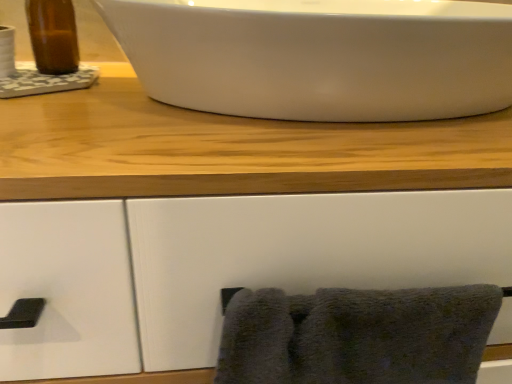
Describe the element at coordinates (356, 335) in the screenshot. I see `dark gray fluffy towel at lower right` at that location.

In order to click on white glossy sink at upper center, acting as the 2th sink starting from the left in this screenshot , I will do `click(320, 57)`.

What do you see at coordinates (46, 57) in the screenshot? I see `brown glass bottle at upper left, the 1th sink when ordered from left to right` at bounding box center [46, 57].

At what (x,y) coordinates should I click in order to perform the action: click on brown glass bottle at upper left, the 1th sink when ordered from left to right. Please return your answer as a coordinate pair (x, y). The width and height of the screenshot is (512, 384). Looking at the image, I should click on (46, 57).

Locate an element on the screen. The image size is (512, 384). dark gray fluffy towel at lower right is located at coordinates (356, 335).

How many degrees apart are the facing directions of white glossy sink at upper center, the 1th sink when ordered from right to left, and dark gray fluffy towel at lower right?

The angular difference between white glossy sink at upper center, the 1th sink when ordered from right to left, and dark gray fluffy towel at lower right is 1.04 degrees.

Can you confirm if white glossy sink at upper center, the 1th sink when ordered from right to left, is positioned to the left of dark gray fluffy towel at lower right?

No.

Looking at this image, is white glossy sink at upper center, acting as the 2th sink starting from the left, turned away from dark gray fluffy towel at lower right?

That's not correct — white glossy sink at upper center, acting as the 2th sink starting from the left, is not looking away from dark gray fluffy towel at lower right.

Are white glossy sink at upper center, acting as the 2th sink starting from the left, and dark gray fluffy towel at lower right far apart?

No, white glossy sink at upper center, acting as the 2th sink starting from the left, is in close proximity to dark gray fluffy towel at lower right.

How different are the orientations of white glossy sink at upper center, acting as the 2th sink starting from the left, and brown glass bottle at upper left, the second sink in the right-to-left sequence, in degrees?

They differ by 0.00122 degrees in their facing directions.

Considering the relative sizes of white glossy sink at upper center, acting as the 2th sink starting from the left, and brown glass bottle at upper left, the 1th sink when ordered from left to right, in the image provided, is white glossy sink at upper center, acting as the 2th sink starting from the left, wider than brown glass bottle at upper left, the 1th sink when ordered from left to right,?

Correct, the width of white glossy sink at upper center, acting as the 2th sink starting from the left, exceeds that of brown glass bottle at upper left, the 1th sink when ordered from left to right.

Identify the location of sink below the brown glass bottle at upper left, the second sink in the right-to-left sequence (from a real-world perspective). The image size is (512, 384). (320, 57).

From a real-world perspective, is white glossy sink at upper center, the 1th sink when ordered from right to left, physically located above or below brown glass bottle at upper left, the second sink in the right-to-left sequence?

white glossy sink at upper center, the 1th sink when ordered from right to left, is situated lower than brown glass bottle at upper left, the second sink in the right-to-left sequence, in the real world.

Are dark gray fluffy towel at lower right and white glossy sink at upper center, acting as the 2th sink starting from the left, beside each other?

No, dark gray fluffy towel at lower right is not touching white glossy sink at upper center, acting as the 2th sink starting from the left.

Which object is more forward, dark gray fluffy towel at lower right or white glossy sink at upper center, the 1th sink when ordered from right to left?

Positioned in front is white glossy sink at upper center, the 1th sink when ordered from right to left.

Is dark gray fluffy towel at lower right aimed at white glossy sink at upper center, acting as the 2th sink starting from the left?

No, dark gray fluffy towel at lower right is not oriented towards white glossy sink at upper center, acting as the 2th sink starting from the left.

Do you think dark gray fluffy towel at lower right is within white glossy sink at upper center, the 1th sink when ordered from right to left, or outside of it?

dark gray fluffy towel at lower right lies outside white glossy sink at upper center, the 1th sink when ordered from right to left.

What's the angular difference between brown glass bottle at upper left, the 1th sink when ordered from left to right, and dark gray fluffy towel at lower right's facing directions?

The angular difference between brown glass bottle at upper left, the 1th sink when ordered from left to right, and dark gray fluffy towel at lower right is 1.04 degrees.

From the image's perspective, is brown glass bottle at upper left, the second sink in the right-to-left sequence, above dark gray fluffy towel at lower right?

Indeed, from the image's perspective, brown glass bottle at upper left, the second sink in the right-to-left sequence, is shown above dark gray fluffy towel at lower right.

Would you say dark gray fluffy towel at lower right is part of brown glass bottle at upper left, the second sink in the right-to-left sequence,'s contents?

Actually, dark gray fluffy towel at lower right is outside brown glass bottle at upper left, the second sink in the right-to-left sequence.

Considering the sizes of objects brown glass bottle at upper left, the 1th sink when ordered from left to right, and dark gray fluffy towel at lower right in the image provided, who is thinner, brown glass bottle at upper left, the 1th sink when ordered from left to right, or dark gray fluffy towel at lower right?

With smaller width is dark gray fluffy towel at lower right.

Would you say dark gray fluffy towel at lower right is to the left or to the right of brown glass bottle at upper left, the second sink in the right-to-left sequence, in the picture?

dark gray fluffy towel at lower right is to the right of brown glass bottle at upper left, the second sink in the right-to-left sequence.

Is brown glass bottle at upper left, the second sink in the right-to-left sequence, located within dark gray fluffy towel at lower right?

No, brown glass bottle at upper left, the second sink in the right-to-left sequence, is not a part of dark gray fluffy towel at lower right.

Does dark gray fluffy towel at lower right have a greater height compared to brown glass bottle at upper left, the 1th sink when ordered from left to right?

Incorrect, the height of dark gray fluffy towel at lower right is not larger of that of brown glass bottle at upper left, the 1th sink when ordered from left to right.

Would you consider brown glass bottle at upper left, the second sink in the right-to-left sequence, to be distant from white glossy sink at upper center, acting as the 2th sink starting from the left?

No, there isn't a large distance between brown glass bottle at upper left, the second sink in the right-to-left sequence, and white glossy sink at upper center, acting as the 2th sink starting from the left.

Is point (10, 77) closer or farther from the camera than point (286, 108)?

Point (10, 77).

Is brown glass bottle at upper left, the second sink in the right-to-left sequence, to the left of white glossy sink at upper center, acting as the 2th sink starting from the left, from the viewer's perspective?

Correct, you'll find brown glass bottle at upper left, the second sink in the right-to-left sequence, to the left of white glossy sink at upper center, acting as the 2th sink starting from the left.

Which of these two, brown glass bottle at upper left, the second sink in the right-to-left sequence, or white glossy sink at upper center, acting as the 2th sink starting from the left, is smaller?

brown glass bottle at upper left, the second sink in the right-to-left sequence, is smaller.

Where is `bath towel on the left side of white glossy sink at upper center, the 1th sink when ordered from right to left`? This screenshot has height=384, width=512. bath towel on the left side of white glossy sink at upper center, the 1th sink when ordered from right to left is located at coordinates (356, 335).

At what (x,y) coordinates should I click in order to perform the action: click on sink on the right of brown glass bottle at upper left, the second sink in the right-to-left sequence. Please return your answer as a coordinate pair (x, y). Looking at the image, I should click on (320, 57).

Based on their spatial positions, is white glossy sink at upper center, acting as the 2th sink starting from the left, or dark gray fluffy towel at lower right further from brown glass bottle at upper left, the second sink in the right-to-left sequence?

dark gray fluffy towel at lower right is further to brown glass bottle at upper left, the second sink in the right-to-left sequence.

Considering their positions, is dark gray fluffy towel at lower right positioned closer to brown glass bottle at upper left, the second sink in the right-to-left sequence, than white glossy sink at upper center, acting as the 2th sink starting from the left?

white glossy sink at upper center, acting as the 2th sink starting from the left.

Estimate the real-world distances between objects in this image. Which object is further from white glossy sink at upper center, the 1th sink when ordered from right to left, brown glass bottle at upper left, the 1th sink when ordered from left to right, or dark gray fluffy towel at lower right?

Among the two, brown glass bottle at upper left, the 1th sink when ordered from left to right, is located further to white glossy sink at upper center, the 1th sink when ordered from right to left.

Considering their positions, is dark gray fluffy towel at lower right positioned closer to white glossy sink at upper center, the 1th sink when ordered from right to left, than brown glass bottle at upper left, the second sink in the right-to-left sequence?

dark gray fluffy towel at lower right lies closer to white glossy sink at upper center, the 1th sink when ordered from right to left, than the other object.

From the image, which object appears to be nearer to dark gray fluffy towel at lower right, brown glass bottle at upper left, the 1th sink when ordered from left to right, or white glossy sink at upper center, acting as the 2th sink starting from the left?

Among the two, white glossy sink at upper center, acting as the 2th sink starting from the left, is located nearer to dark gray fluffy towel at lower right.

Considering their positions, is white glossy sink at upper center, acting as the 2th sink starting from the left, positioned closer to dark gray fluffy towel at lower right than brown glass bottle at upper left, the second sink in the right-to-left sequence?

white glossy sink at upper center, acting as the 2th sink starting from the left.

Find the location of a particular element. bath towel between brown glass bottle at upper left, the second sink in the right-to-left sequence, and white glossy sink at upper center, acting as the 2th sink starting from the left is located at coordinates (356, 335).